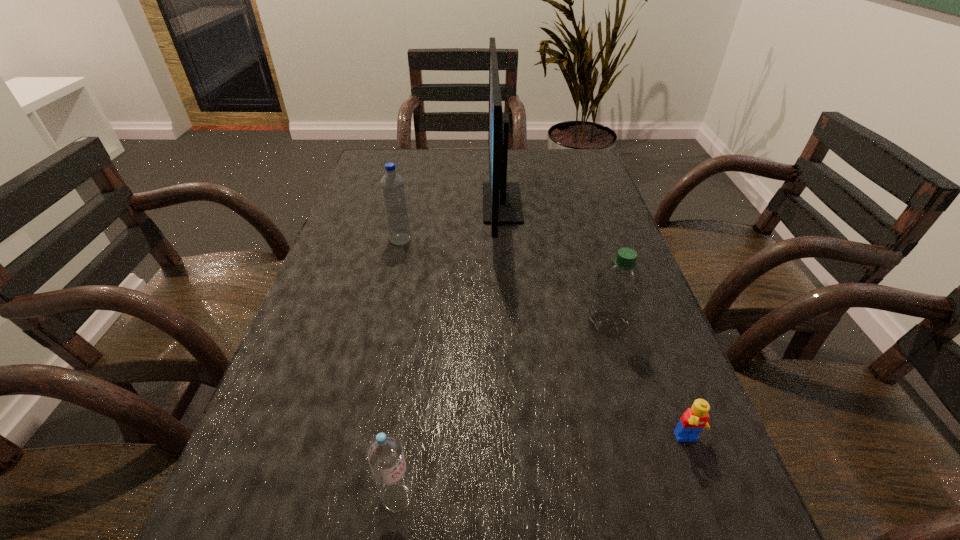
The image size is (960, 540). Identify the location of the third object from right to left. (502, 204).

Image resolution: width=960 pixels, height=540 pixels. Identify the location of the tallest object. (502, 204).

At what (x,y) coordinates should I click in order to perform the action: click on the farthest water bottle. Please return your answer as a coordinate pair (x, y). The width and height of the screenshot is (960, 540). Looking at the image, I should click on (392, 184).

The height and width of the screenshot is (540, 960). I want to click on the leftmost water bottle, so click(392, 184).

Find the location of `the third nearest object`. the third nearest object is located at coordinates (618, 289).

Where is `the fourth object from left to right`? The width and height of the screenshot is (960, 540). the fourth object from left to right is located at coordinates (618, 289).

Identify the location of the fourth object from right to left. (384, 452).

Locate an element on the screen. the second water bottle from left to right is located at coordinates (384, 452).

I want to click on the rightmost object, so click(694, 420).

Identify the location of Lego. Image resolution: width=960 pixels, height=540 pixels. (694, 420).